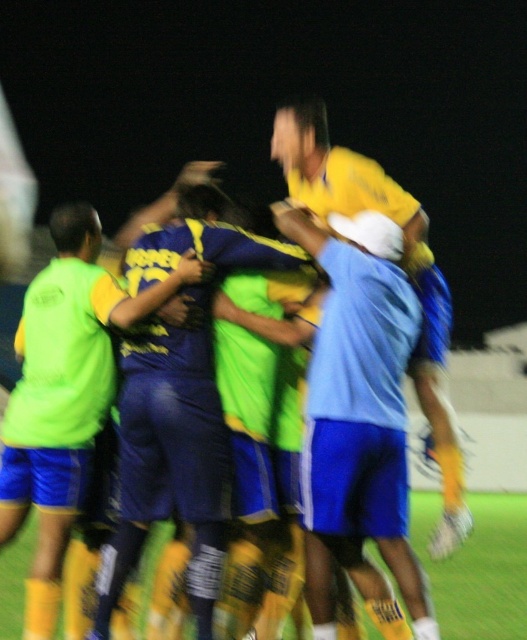
Looking at this image, you are a photographer at the soccer match and want to capture a photo of the neon green jersey at left and the yellow matte jersey at center. If your camera has a depth of field that can focus on objects within a 5 feet range, will both jerseys be in focus?

The neon green jersey at left is 8.71 feet away from the yellow matte jersey at center. Since the distance between them exceeds the 5 feet range of the camera, they cannot both be in focus simultaneously.

You are a soccer player who just scored a goal and want to celebrate by jumping towards the point with coordinates (403, 268). Which object from the scene will you land on?

The point at coordinates (403, 268) corresponds to the yellow matte jersey at center, so you will land on the yellow matte jersey at center.